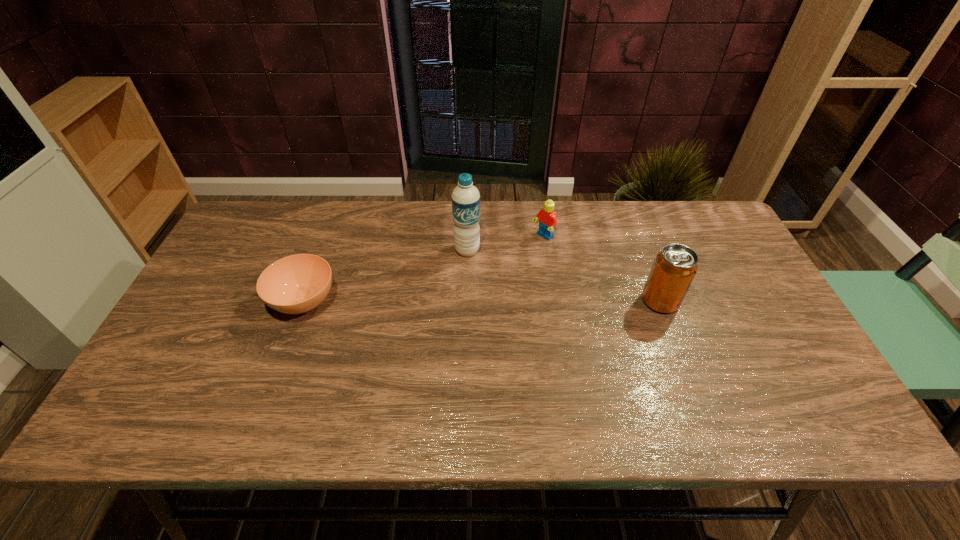
The image size is (960, 540). In order to click on free space on the desktop that is between the soup bowl and the rightmost object and is positioned on the label of the tallest object in this screenshot , I will do `click(458, 301)`.

Where is `free space on the desktop that is between the soup bowl and the soda can and is positioned on the face of the Lego`? The width and height of the screenshot is (960, 540). free space on the desktop that is between the soup bowl and the soda can and is positioned on the face of the Lego is located at coordinates (454, 301).